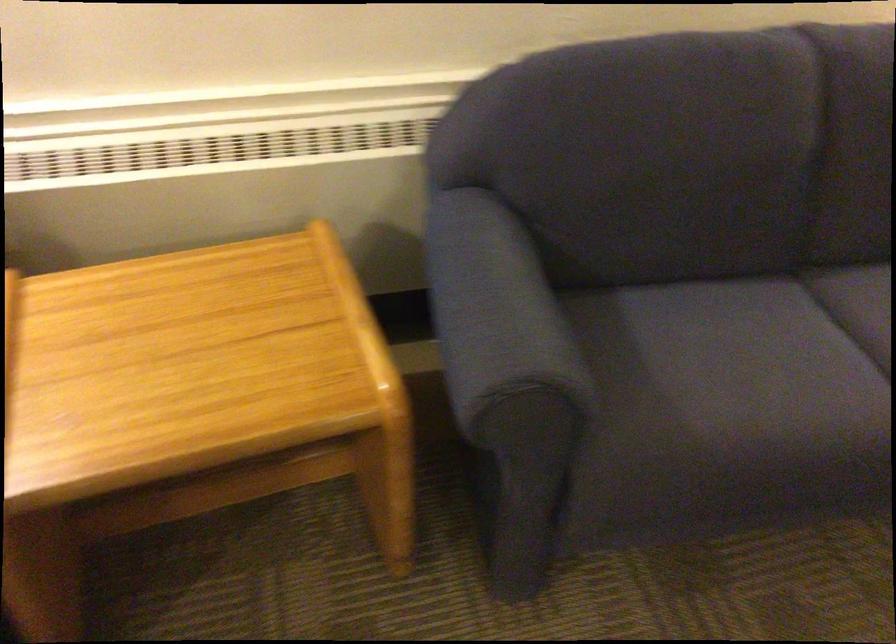
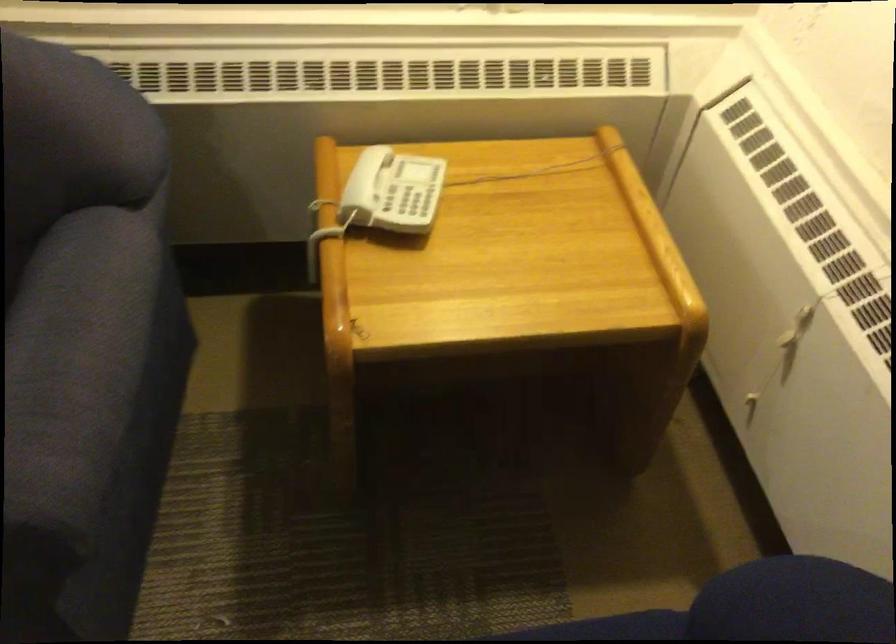
Question: What movement of the cameraman would produce the second image?

Choices:
 (A) Left
 (B) Right
 (C) Forward
 (D) Backward

Answer: (B)